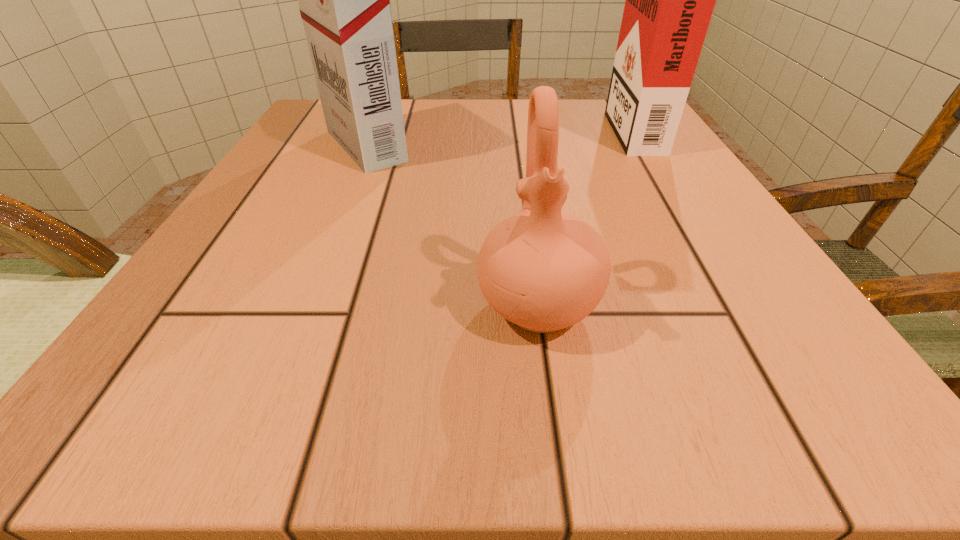
Locate an element on the screen. Image resolution: width=960 pixels, height=540 pixels. vacant space that is in between the leftmost object and the rightmost object is located at coordinates (498, 137).

This screenshot has width=960, height=540. I want to click on blank region between the nearest object and the right cigarette case, so click(585, 217).

Identify which object is the nearest to the leftmost object. Please provide its 2D coordinates. Your answer should be formatted as a tuple, i.e. [(x, y)], where the tuple contains the x and y coordinates of a point satisfying the conditions above.

[(543, 270)]

Identify which object is the second nearest to the shorter cigarette case. Please provide its 2D coordinates. Your answer should be formatted as a tuple, i.e. [(x, y)], where the tuple contains the x and y coordinates of a point satisfying the conditions above.

[(344, 0)]

Where is `blank space that satisfies the following two spatial constraints: 1. on the front-facing side of the rightmost object; 2. on the spout of the second object from right to left`? blank space that satisfies the following two spatial constraints: 1. on the front-facing side of the rightmost object; 2. on the spout of the second object from right to left is located at coordinates (739, 306).

Find the location of a particular element. vacant area in the image that satisfies the following two spatial constraints: 1. on the front-facing side of the rightmost object; 2. on the spout of the pottery is located at coordinates (739, 306).

Identify the location of vacant space that satisfies the following two spatial constraints: 1. on the front-facing side of the right cigarette case; 2. on the spout of the second object from right to left. The height and width of the screenshot is (540, 960). (739, 306).

At what (x,y) coordinates should I click in order to perform the action: click on free space that satisfies the following two spatial constraints: 1. on the front-facing side of the rightmost object; 2. on the spout of the pottery. Please return your answer as a coordinate pair (x, y). This screenshot has width=960, height=540. Looking at the image, I should click on (739, 306).

Locate an element on the screen. This screenshot has width=960, height=540. free space that satisfies the following two spatial constraints: 1. on the front-facing side of the right cigarette case; 2. on the front side of the leftmost object is located at coordinates (642, 146).

You are a GUI agent. You are given a task and a screenshot of the screen. Output one action in this format:
    pyautogui.click(x=<x>, y=<y>)
    Task: Click on the vacant space that satisfies the following two spatial constraints: 1. on the front-facing side of the right cigarette case; 2. on the front side of the left cigarette case
    
    Given the screenshot: What is the action you would take?
    pyautogui.click(x=642, y=146)